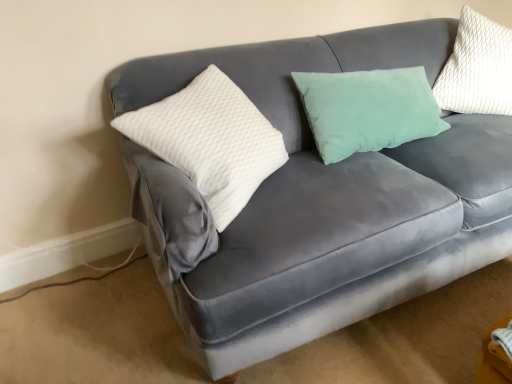
Question: Should I look upward or downward to see white textured pillow at upper right, placed as the second pillow when sorted from left to right?

Choices:
 (A) up
 (B) down

Answer: (A)

Question: Is white textured pillow at left, positioned as the 2th pillow in right-to-left order, completely or partially outside of white textured pillow at upper right, the 1th pillow in the right-to-left sequence?

Choices:
 (A) no
 (B) yes

Answer: (B)

Question: Considering the relative sizes of white textured pillow at left, positioned as the 2th pillow in right-to-left order, and white textured pillow at upper right, the 1th pillow in the right-to-left sequence, in the image provided, is white textured pillow at left, positioned as the 2th pillow in right-to-left order, wider than white textured pillow at upper right, the 1th pillow in the right-to-left sequence,?

Choices:
 (A) yes
 (B) no

Answer: (A)

Question: From the image's perspective, is white textured pillow at left, positioned as the 2th pillow in right-to-left order, located beneath white textured pillow at upper right, the 1th pillow in the right-to-left sequence?

Choices:
 (A) yes
 (B) no

Answer: (A)

Question: Is white textured pillow at left, the first pillow viewed from the left, not near white textured pillow at upper right, the 1th pillow in the right-to-left sequence?

Choices:
 (A) no
 (B) yes

Answer: (A)

Question: Is the surface of white textured pillow at left, positioned as the 2th pillow in right-to-left order, in direct contact with white textured pillow at upper right, the 1th pillow in the right-to-left sequence?

Choices:
 (A) yes
 (B) no

Answer: (B)

Question: Is white textured pillow at left, the first pillow viewed from the left, further to camera compared to white textured pillow at upper right, the 1th pillow in the right-to-left sequence?

Choices:
 (A) yes
 (B) no

Answer: (B)

Question: Is white textured pillow at upper right, the 1th pillow in the right-to-left sequence, oriented away from white textured pillow at left, positioned as the 2th pillow in right-to-left order?

Choices:
 (A) no
 (B) yes

Answer: (A)

Question: Is white textured pillow at upper right, the 1th pillow in the right-to-left sequence, further to camera compared to white textured pillow at left, the first pillow viewed from the left?

Choices:
 (A) yes
 (B) no

Answer: (A)

Question: Does white textured pillow at upper right, the 1th pillow in the right-to-left sequence, lie in front of white textured pillow at left, positioned as the 2th pillow in right-to-left order?

Choices:
 (A) yes
 (B) no

Answer: (B)

Question: Are white textured pillow at upper right, placed as the second pillow when sorted from left to right, and white textured pillow at left, the first pillow viewed from the left, far apart?

Choices:
 (A) yes
 (B) no

Answer: (B)

Question: Is white textured pillow at upper right, the 1th pillow in the right-to-left sequence, next to white textured pillow at left, the first pillow viewed from the left?

Choices:
 (A) yes
 (B) no

Answer: (B)

Question: Is white textured pillow at left, the first pillow viewed from the left, inside white textured pillow at upper right, placed as the second pillow when sorted from left to right?

Choices:
 (A) no
 (B) yes

Answer: (A)

Question: From their relative heights in the image, would you say white textured pillow at upper right, placed as the second pillow when sorted from left to right, is taller or shorter than white textured pillow at left, the first pillow viewed from the left?

Choices:
 (A) short
 (B) tall

Answer: (B)